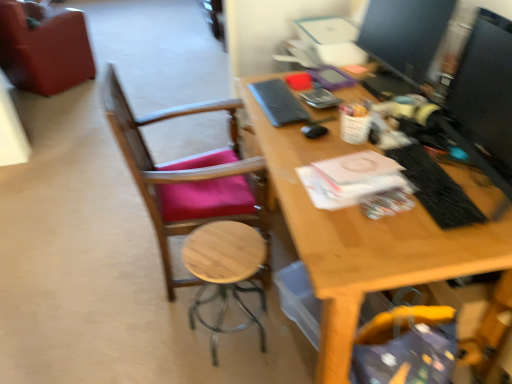
Find the location of a particular element. vacant area that lies in front of wooden chair at left, which is the first chair in front-to-back order is located at coordinates (177, 349).